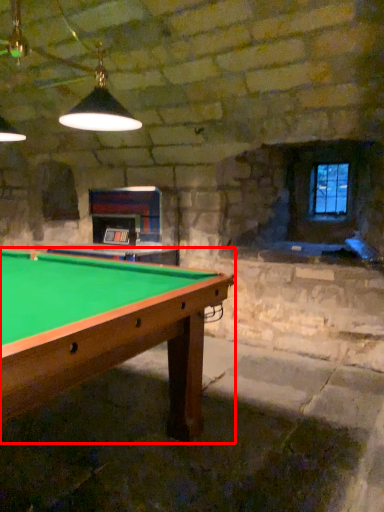
Question: From the image, what is the correct spatial relationship of billiard table (annotated by the red box) in relation to window?

Choices:
 (A) right
 (B) left

Answer: (B)